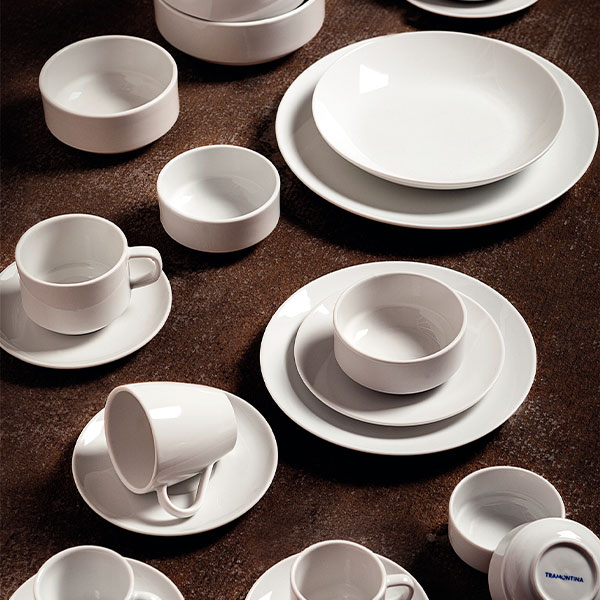
Find the location of `rim of a large bowl`. rim of a large bowl is located at coordinates (439, 181), (311, 106), (431, 31), (563, 110), (528, 163), (357, 160), (355, 51), (513, 47).